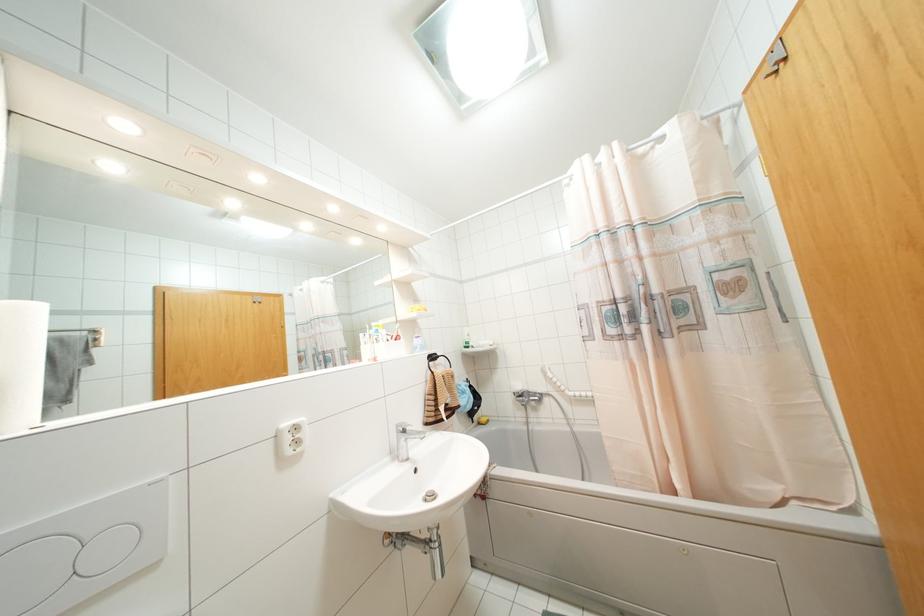
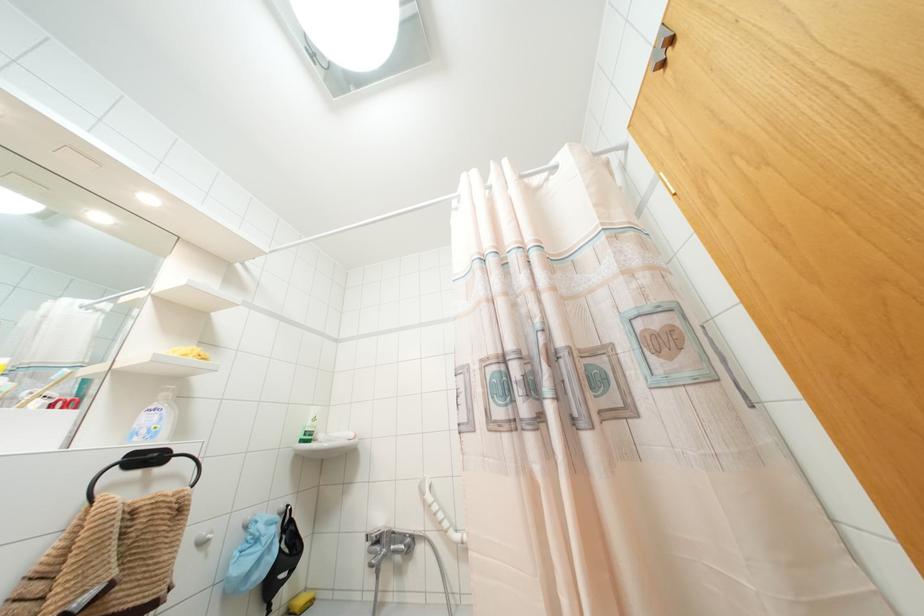
In a continuous first-person perspective shot, in which direction is the camera moving?

The cameraman walked toward right, forward.